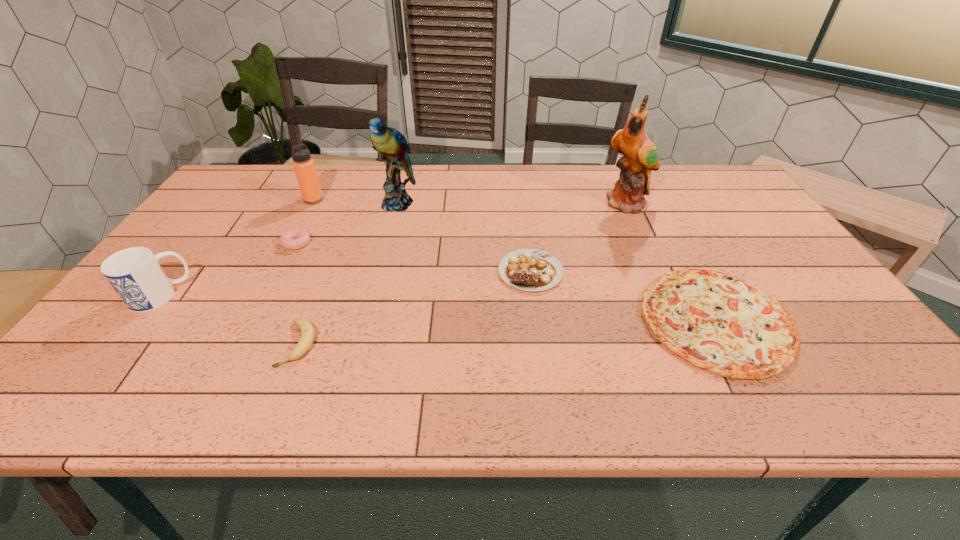
You are a GUI agent. You are given a task and a screenshot of the screen. Output one action in this format:
    pyautogui.click(x=<x>, y=<y>)
    Task: Click on the shortest object
    This screenshot has width=960, height=540.
    Given the screenshot: What is the action you would take?
    pyautogui.click(x=718, y=322)

This screenshot has width=960, height=540. I want to click on free region located 0.170m on the front-facing side of the taller parrot, so click(x=649, y=250).

In order to click on vacant region located 0.360m on the face of the left parrot in this screenshot , I will do `click(373, 297)`.

In order to click on free space located 0.280m on the front of the thermos bottle in this screenshot , I will do `click(282, 260)`.

Where is `free region located on the back of the fifth shortest object`? The width and height of the screenshot is (960, 540). free region located on the back of the fifth shortest object is located at coordinates (203, 240).

This screenshot has height=540, width=960. Identify the location of free space located on the left of the sixth object from left to right. (435, 272).

Find the location of a particular element. Image resolution: width=960 pixels, height=540 pixels. vacant space situated 0.240m on the left of the doughnut is located at coordinates (200, 243).

Where is `free spot located 0.050m at the stem of the banana`? The image size is (960, 540). free spot located 0.050m at the stem of the banana is located at coordinates point(281,389).

This screenshot has height=540, width=960. I want to click on vacant area situated on the left of the pizza, so click(x=584, y=320).

The image size is (960, 540). Identify the location of thermos bottle that is at the far edge. (304, 167).